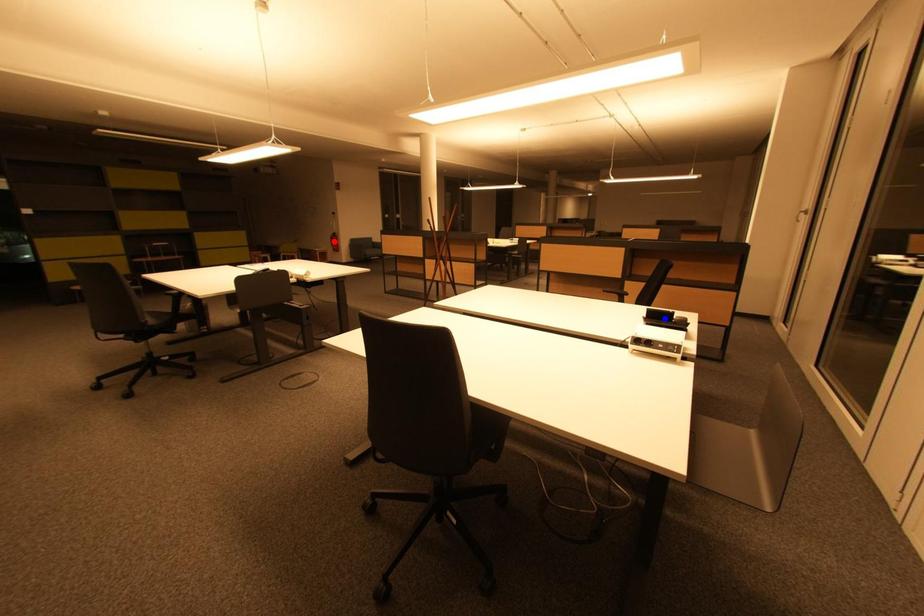
Question: In the image, two points are highlighted. Which point is nearer to the camera? Reply with the corresponding letter.

Choices:
 (A) blue point
 (B) red point

Answer: (A)